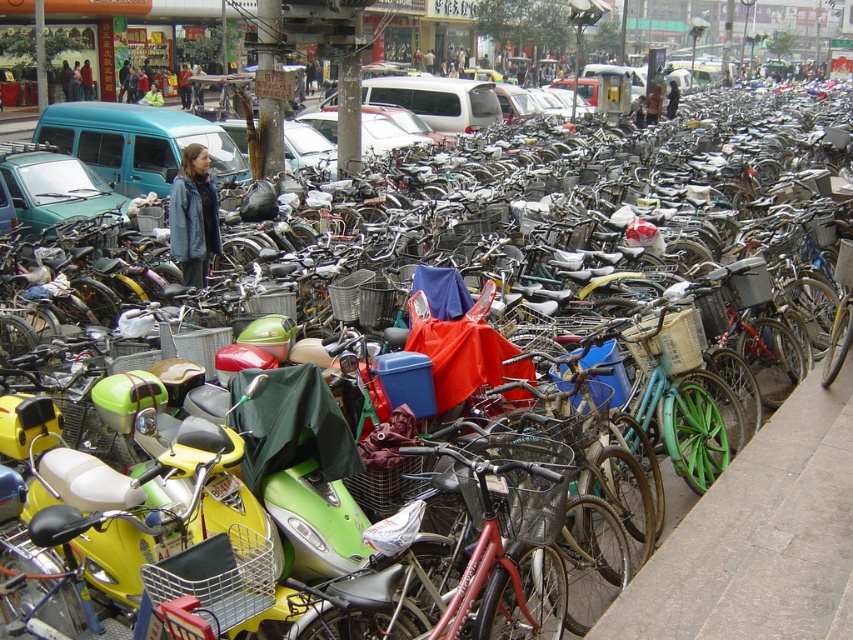
You are standing at the point marked as point (144,518). What object is located exactly at that point?

The yellow matte scooter at lower left is located exactly at point (144,518).

You are a delivery person trying to navigate through the parking area. You need to move from the gray concrete pavement at lower right to the matte green van at left. Is the path between them clear?

The gray concrete pavement at lower right is in front of the matte green van at left, meaning the van is behind the pavement. There might be a clear path between them, but the scene description mentions the parking area is densely packed with bicycles and scooters, so the path could be obstructed by vehicles. Check for space between the bikes and scooters before proceeding.

You are a delivery person trying to navigate through the parking area. You need to pass between the yellow matte scooter at lower left and the matte green van at left. Can you fit a standard delivery cart that is 1.2 meters wide through the gap between them?

The yellow matte scooter at lower left is thinner than the matte green van at left, but without knowing the exact width of the gap, it is impossible to determine if the 1.2 meter delivery cart can fit through.